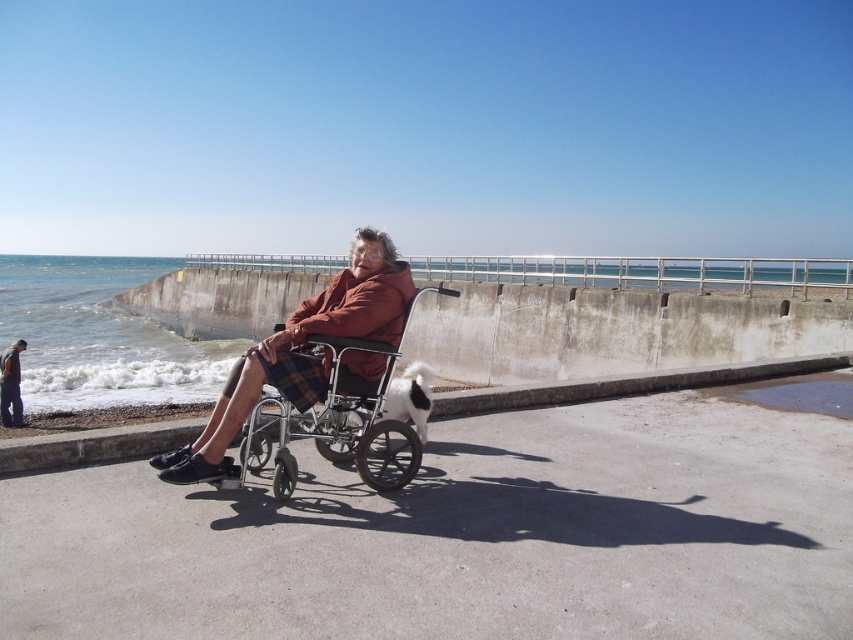
You are a person in a wheelchair trying to reach the ocean from your current position. The concrete at lower center is the path you must take. Can you pass through the path if your wheelchair is the same size as the dark brown leather jacket at lower left?

The concrete at lower center is larger in size than the dark brown leather jacket at lower left. Since the wheelchair is the same size as the jacket, there should be enough space to pass through the path.

You are standing at the center of the image and want to walk to the concrete at lower center. Which direction should you go?

You should move downward because the concrete at lower center is located below your current position at the center of the image.

You are a photographer standing on the promenade. You want to take a photo of the white sand at lower left and the dark brown leather jacket at lower left. Which object will appear closer to the bottom edge of the photo?

The white sand at lower left is shorter than the dark brown leather jacket at lower left, so the white sand at lower left will appear closer to the bottom edge of the photo.